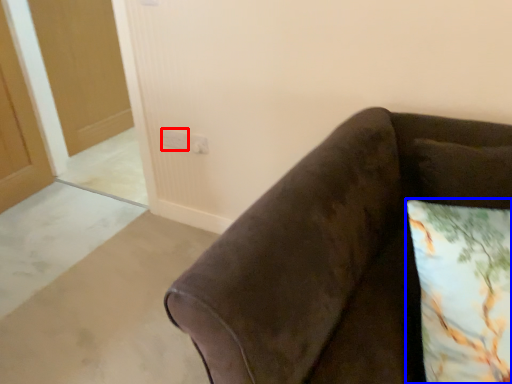
Question: Which object appears farthest to the camera in this image, electric outlet (highlighted by a red box) or pillow (highlighted by a blue box)?

Choices:
 (A) electric outlet
 (B) pillow

Answer: (A)